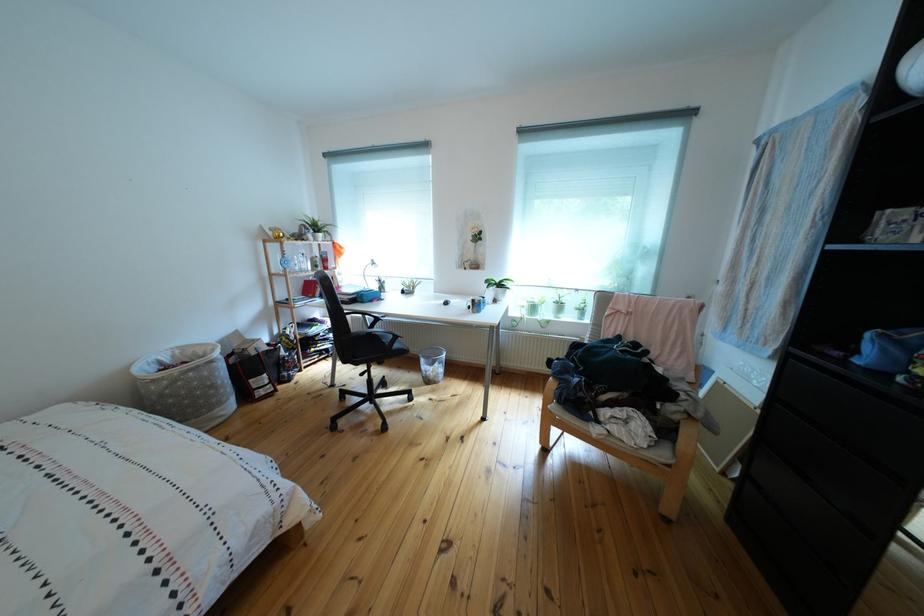
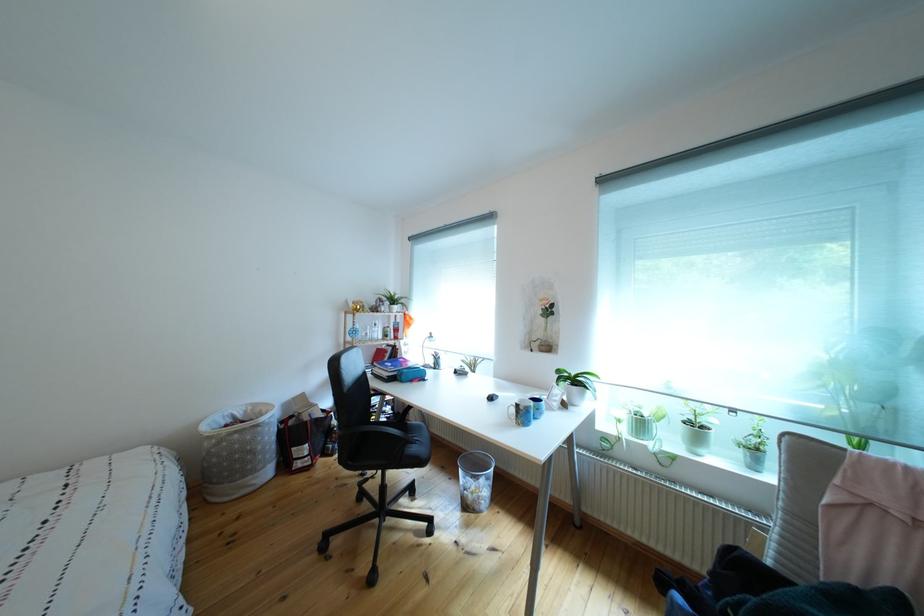
In the second image, find the point that corresponds to (312,277) in the first image.

(383, 345)